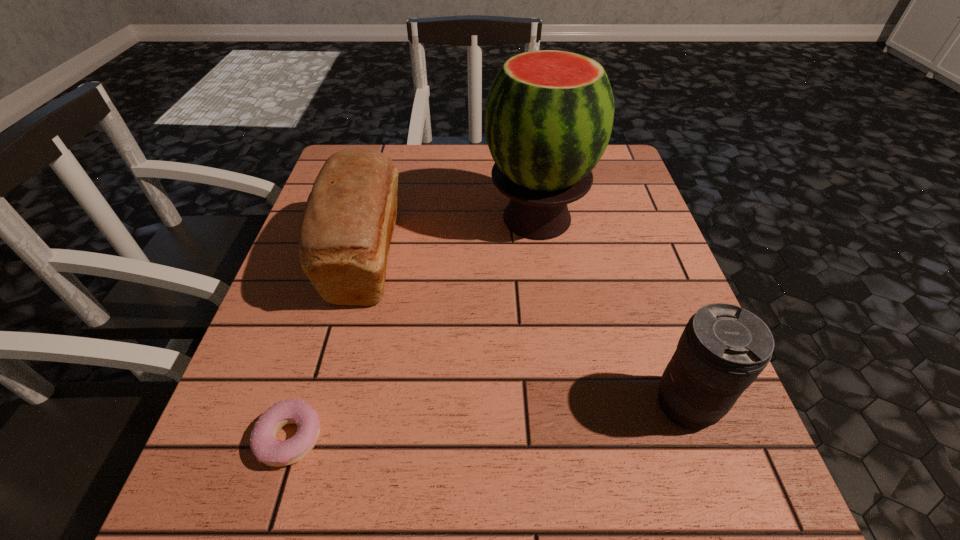
Where is `empty location between the rightmost object and the doughnut`? This screenshot has height=540, width=960. empty location between the rightmost object and the doughnut is located at coordinates (488, 421).

This screenshot has height=540, width=960. In order to click on empty space that is in between the bread and the tallest object in this screenshot , I will do `click(451, 238)`.

Image resolution: width=960 pixels, height=540 pixels. What are the coordinates of `free point between the tallest object and the bread` in the screenshot? It's located at (451, 238).

Find the location of a particular element. The height and width of the screenshot is (540, 960). free spot between the rightmost object and the second object from right to left is located at coordinates (611, 312).

You are a GUI agent. You are given a task and a screenshot of the screen. Output one action in this format:
    pyautogui.click(x=<x>, y=<y>)
    Task: Click on the free area in between the tallest object and the bread
    This screenshot has height=540, width=960.
    Given the screenshot: What is the action you would take?
    (451, 238)

I want to click on object that stands as the second closest to the telephoto lens, so click(x=347, y=226).

Identify which object is the third nearest to the telephoto lens. Please provide its 2D coordinates. Your answer should be formatted as a tuple, i.e. [(x, y)], where the tuple contains the x and y coordinates of a point satisfying the conditions above.

[(263, 443)]

At what (x,y) coordinates should I click in order to perform the action: click on free space in the image that satisfies the following two spatial constraints: 1. on the back side of the third object from left to right; 2. on the right side of the bread. Please return your answer as a coordinate pair (x, y). The image size is (960, 540). Looking at the image, I should click on (376, 218).

You are a GUI agent. You are given a task and a screenshot of the screen. Output one action in this format:
    pyautogui.click(x=<x>, y=<y>)
    Task: Click on the blank space that satisfies the following two spatial constraints: 1. on the side of the telephoto lens where the control switches are located; 2. on the front side of the shortest object
    This screenshot has height=540, width=960.
    Given the screenshot: What is the action you would take?
    pyautogui.click(x=697, y=437)